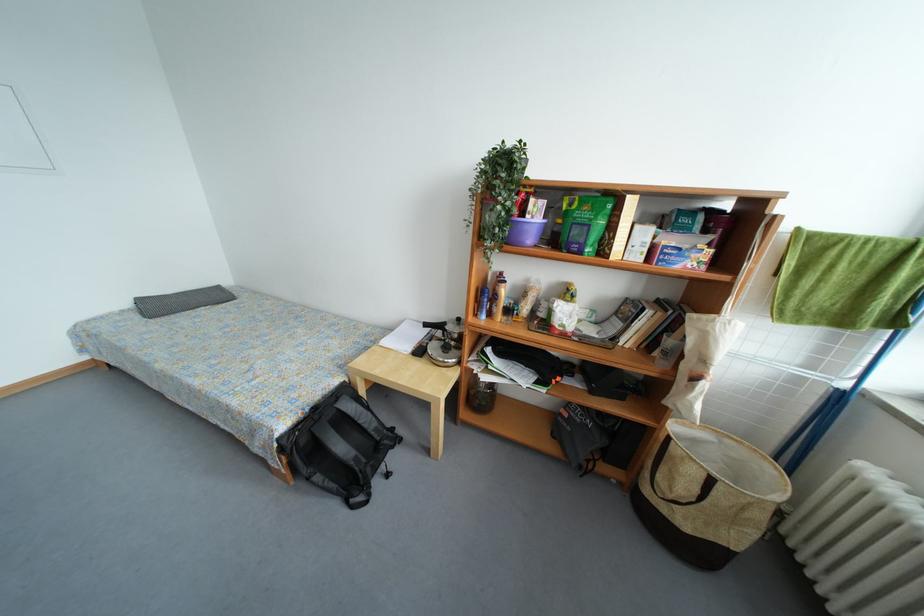
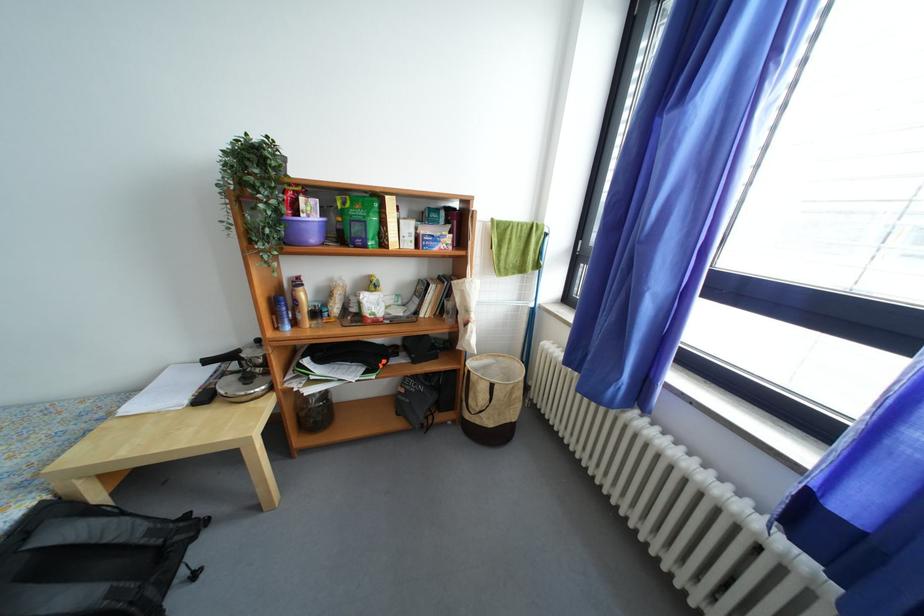
The point at (x=492, y=383) is marked in the first image. Where is the corresponding point in the second image?

(315, 395)